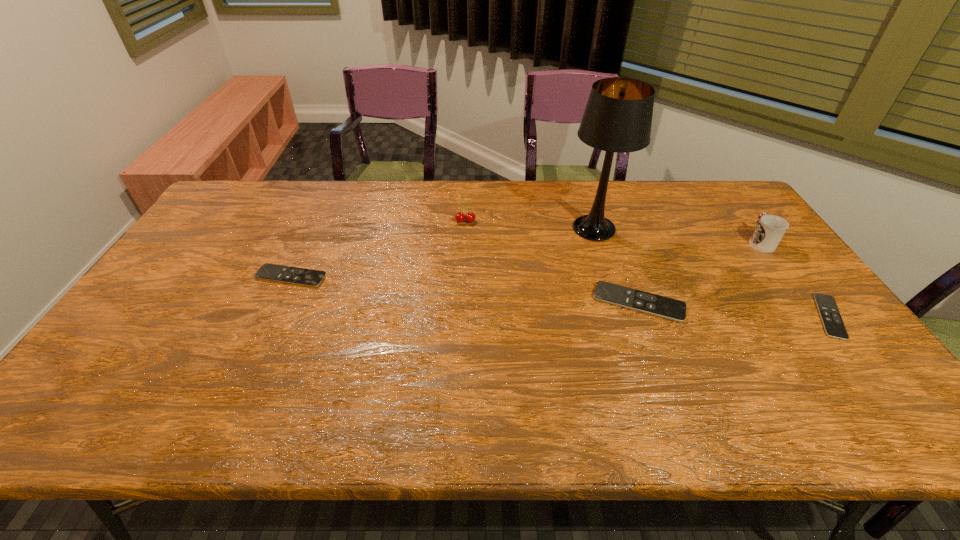
To make them evenly spaced by inserting another remote_control among them, please locate a vacant spot for this new remote_control. Please provide its 2D coordinates. Your answer should be formatted as a tuple, i.e. [(x, y)], where the tuple contains the x and y coordinates of a point satisfying the conditions above.

[(460, 289)]